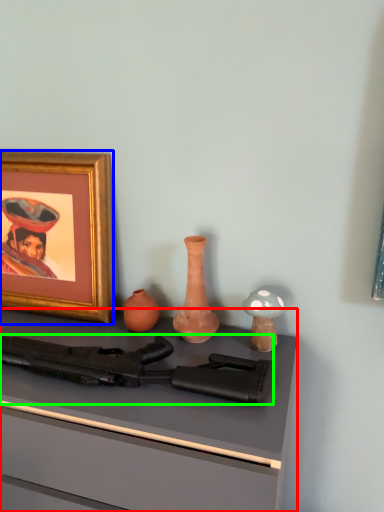
Question: Based on their relative distances, which object is nearer to desk (highlighted by a red box)? Choose from picture frame (highlighted by a blue box) and rifle (highlighted by a green box).

Choices:
 (A) picture frame
 (B) rifle

Answer: (B)